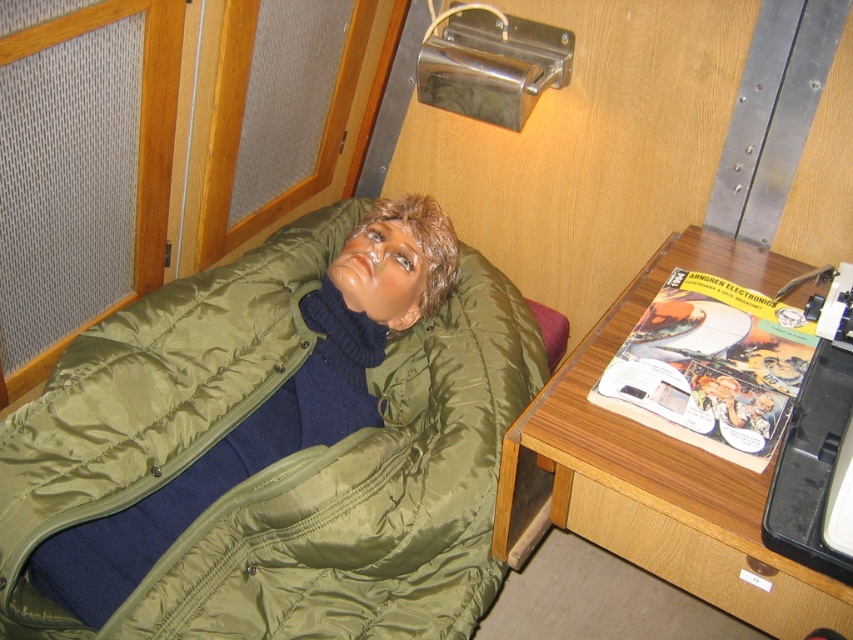
Does olive green quilted jacket at center appear under wooden desk at lower right?

No, olive green quilted jacket at center is not below wooden desk at lower right.

Between olive green quilted jacket at center and wooden desk at lower right, which one is positioned higher?

Positioned higher is olive green quilted jacket at center.

At what (x,y) coordinates should I click in order to perform the action: click on olive green quilted jacket at center. Please return your answer as a coordinate pair (x, y). This screenshot has width=853, height=640. Looking at the image, I should click on (264, 404).